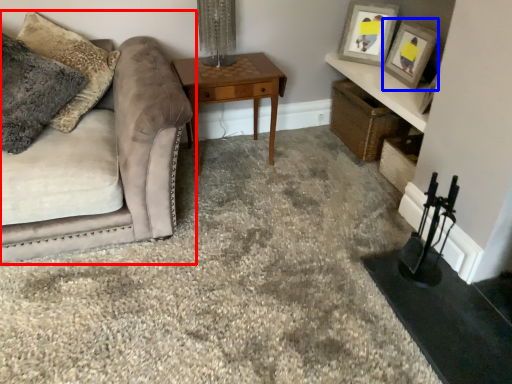
Question: Which object appears farthest to the camera in this image, studio couch (highlighted by a red box) or picture frame (highlighted by a blue box)?

Choices:
 (A) studio couch
 (B) picture frame

Answer: (B)